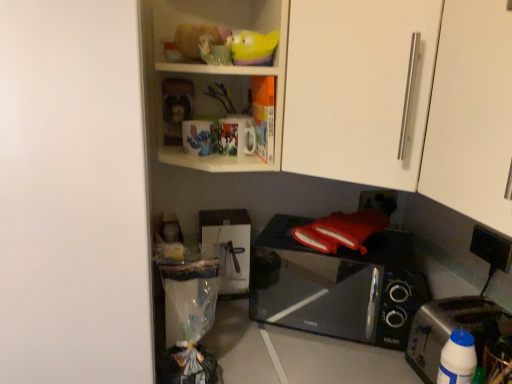
Question: From a real-world perspective, is black glossy microwave oven at lower right physically below black plastic electric outlet at lower right?

Choices:
 (A) yes
 (B) no

Answer: (A)

Question: Is black glossy microwave oven at lower right in front of black plastic electric outlet at lower right?

Choices:
 (A) yes
 (B) no

Answer: (A)

Question: Does black glossy microwave oven at lower right have a greater height compared to black plastic electric outlet at lower right?

Choices:
 (A) no
 (B) yes

Answer: (B)

Question: Is black glossy microwave oven at lower right touching black plastic electric outlet at lower right?

Choices:
 (A) no
 (B) yes

Answer: (A)

Question: Considering the relative sizes of black glossy microwave oven at lower right and black plastic electric outlet at lower right in the image provided, is black glossy microwave oven at lower right thinner than black plastic electric outlet at lower right?

Choices:
 (A) yes
 (B) no

Answer: (B)

Question: From the image's perspective, is black glossy microwave oven at lower right below black plastic electric outlet at lower right?

Choices:
 (A) no
 (B) yes

Answer: (B)

Question: From a real-world perspective, is silver metallic toaster at lower right physically above yellow rubber duck at upper center?

Choices:
 (A) no
 (B) yes

Answer: (A)

Question: From a real-world perspective, is silver metallic toaster at lower right below yellow rubber duck at upper center?

Choices:
 (A) yes
 (B) no

Answer: (A)

Question: Is silver metallic toaster at lower right oriented away from yellow rubber duck at upper center?

Choices:
 (A) yes
 (B) no

Answer: (B)

Question: From the image's perspective, is silver metallic toaster at lower right under yellow rubber duck at upper center?

Choices:
 (A) yes
 (B) no

Answer: (A)

Question: Is silver metallic toaster at lower right far away from yellow rubber duck at upper center?

Choices:
 (A) no
 (B) yes

Answer: (A)

Question: Is silver metallic toaster at lower right closer to camera compared to yellow rubber duck at upper center?

Choices:
 (A) no
 (B) yes

Answer: (B)

Question: Considering the relative sizes of black plastic electric outlet at lower right and silver metallic toaster at lower right in the image provided, is black plastic electric outlet at lower right wider than silver metallic toaster at lower right?

Choices:
 (A) yes
 (B) no

Answer: (B)